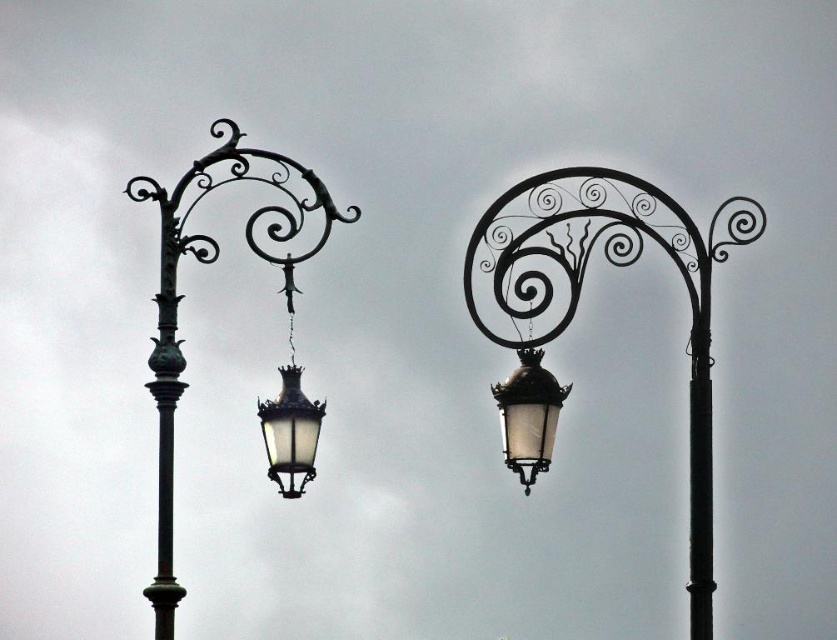
Does black metal pole at right have a lesser width compared to matte glass lantern at center?

No, black metal pole at right is not thinner than matte glass lantern at center.

Is point (701, 634) less distant than point (524, 394)?

Yes, it is.

Where is `black metal pole at right`? black metal pole at right is located at coordinates coord(701,458).

Between point (538, 404) and point (291, 310), which one is positioned in front?

Positioned in front is point (291, 310).

Does matte black street light at center appear over polished brass street light at left?

Yes, matte black street light at center is above polished brass street light at left.

What do you see at coordinates (574, 308) in the screenshot?
I see `matte black street light at center` at bounding box center [574, 308].

This screenshot has height=640, width=837. What are the coordinates of `matte black street light at center` in the screenshot? It's located at (574, 308).

Does matte black street light at center appear on the right side of matte glass lantern at center?

Yes, matte black street light at center is to the right of matte glass lantern at center.

At what (x,y) coordinates should I click in order to perform the action: click on matte black street light at center. Please return your answer as a coordinate pair (x, y). Looking at the image, I should click on 574,308.